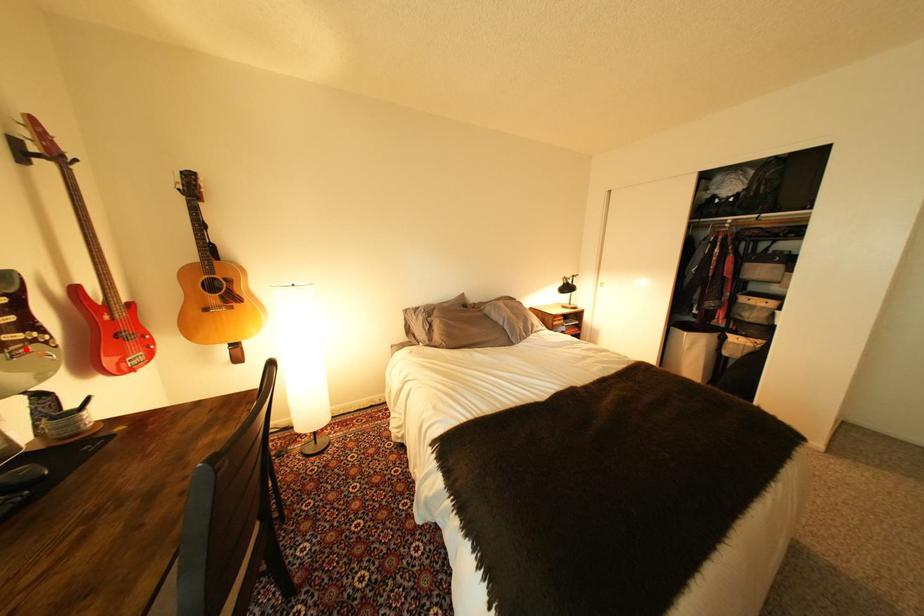
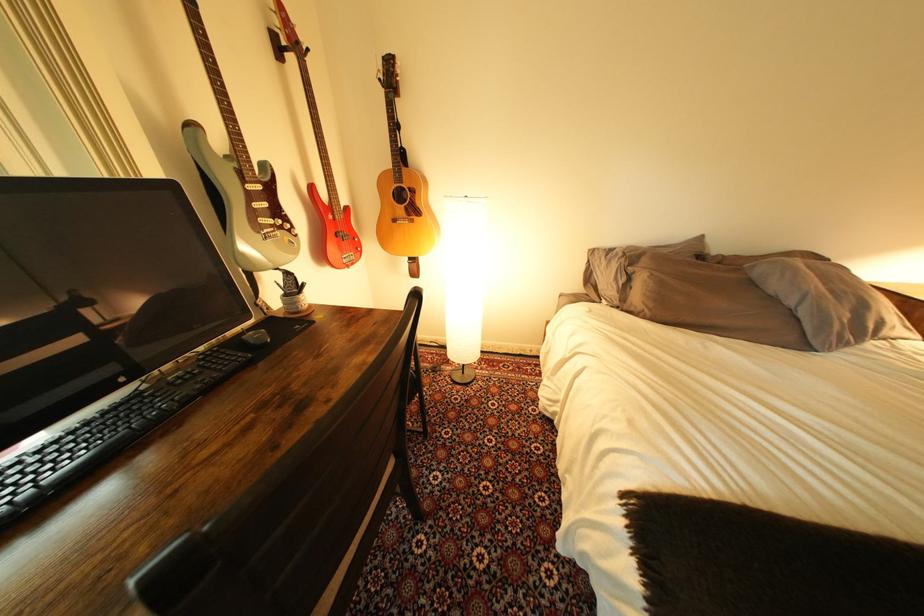
Question: I am providing you with two images of the same scene from different viewpoints. Given a red point in image1, look at the same physical point in image2. Is it:

Choices:
 (A) Closer to the viewpoint
 (B) Farther from the viewpoint

Answer: (A)